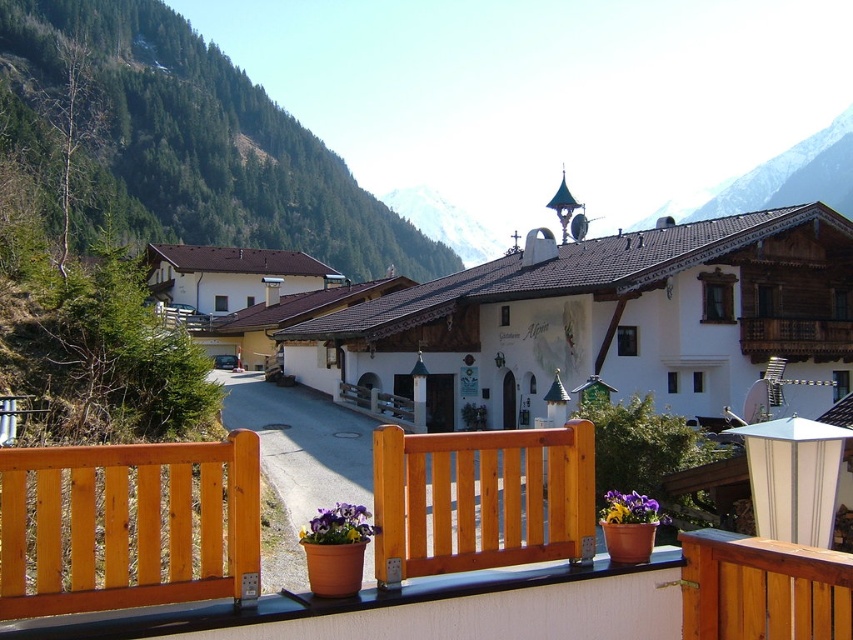
Question: Among these objects, which one is farthest from the camera?

Choices:
 (A) purple matte flower at lower center
 (B) light brown wooden bench at lower left
 (C) purple matte flower pot at lower center
 (D) light brown wooden balustrade at center

Answer: (C)

Question: Which object appears farthest from the camera in this image?

Choices:
 (A) light brown wooden bench at lower left
 (B) purple matte flower pot at lower center

Answer: (B)

Question: Can you confirm if white wooden building at center is positioned to the left of purple matte flower at lower center?

Choices:
 (A) no
 (B) yes

Answer: (B)

Question: Does light brown wooden bench at lower left come behind purple matte flower pot at lower center?

Choices:
 (A) no
 (B) yes

Answer: (A)

Question: Which of the following is the farthest from the observer?

Choices:
 (A) light brown wooden bench at lower left
 (B) purple matte flower pot at lower center
 (C) purple matte flower at lower center
 (D) light brown wooden balustrade at center

Answer: (B)

Question: Where is light brown wooden balustrade at center located in relation to purple matte flower at lower center in the image?

Choices:
 (A) above
 (B) below

Answer: (A)